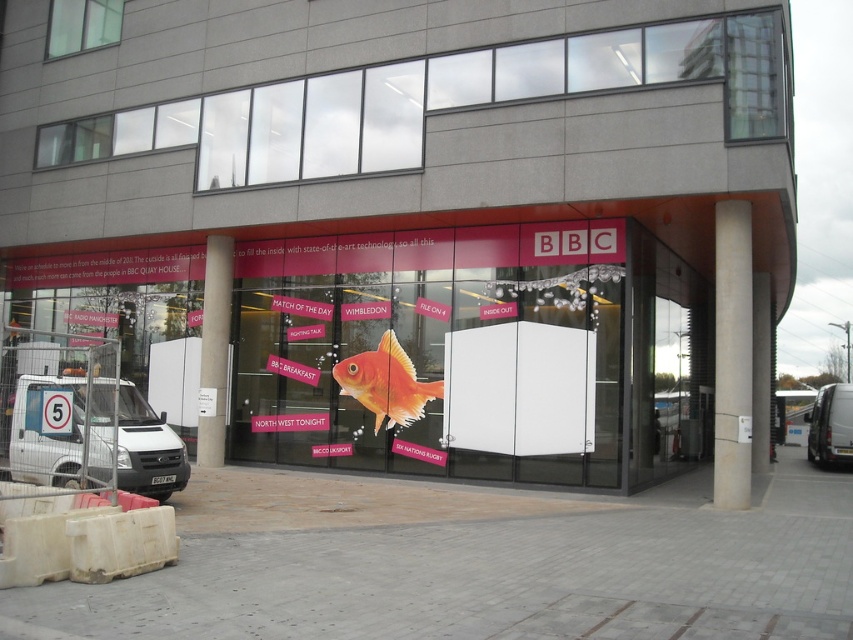
Looking at this image, you are a delivery person driving a white matte van at left and need to park it near the entrance of the building. The parking spot available is 8 meters long. Can your van fit in the parking spot?

The white matte van at left and camera are 7.65 meters apart. Since the parking spot is 8 meters long, the van can fit as it is shorter than the available space.

You are a delivery driver who needs to park your white matte van at left in a spot that requires clearance of 2 meters in height. You see the matte glass fish at center on the building. Can you safely park your van there based on the height?

The matte glass fish at center is taller than the white matte van at left. Since the van requires a 2 meter clearance, and the fish is taller than the van, the van should be able to park safely as long as the fish height is above 2 meters. However, without exact measurements, it is uncertain. The information provided does not specify the exact height of the fish or the van, only their relative sizes.

You are standing at the entrance of the building and want to take a photo that includes both the BBC logo and the orange fish graphic. Which point, point (564, 113) or point (834, 419), is closer to your current position?

Point (564, 113) is closer to the camera than point (834, 419), so it is closer to your current position.